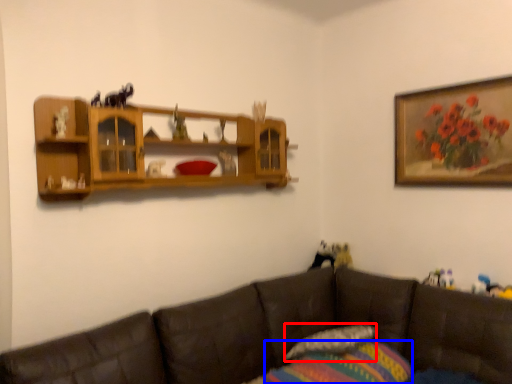
Question: Which object is closer to the camera taking this photo, pillow (highlighted by a red box) or pillow (highlighted by a blue box)?

Choices:
 (A) pillow
 (B) pillow

Answer: (B)